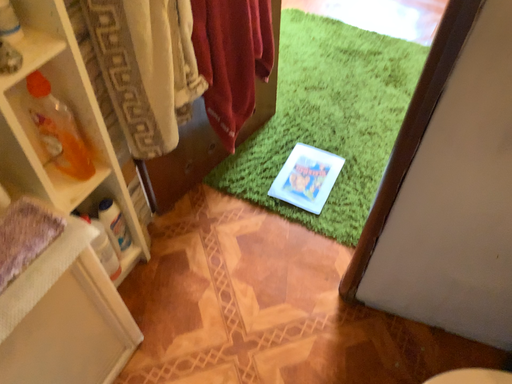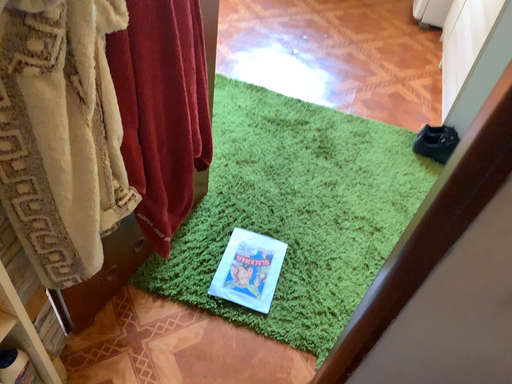
Question: Which way did the camera rotate in the video?

Choices:
 (A) rotated right
 (B) rotated left

Answer: (A)